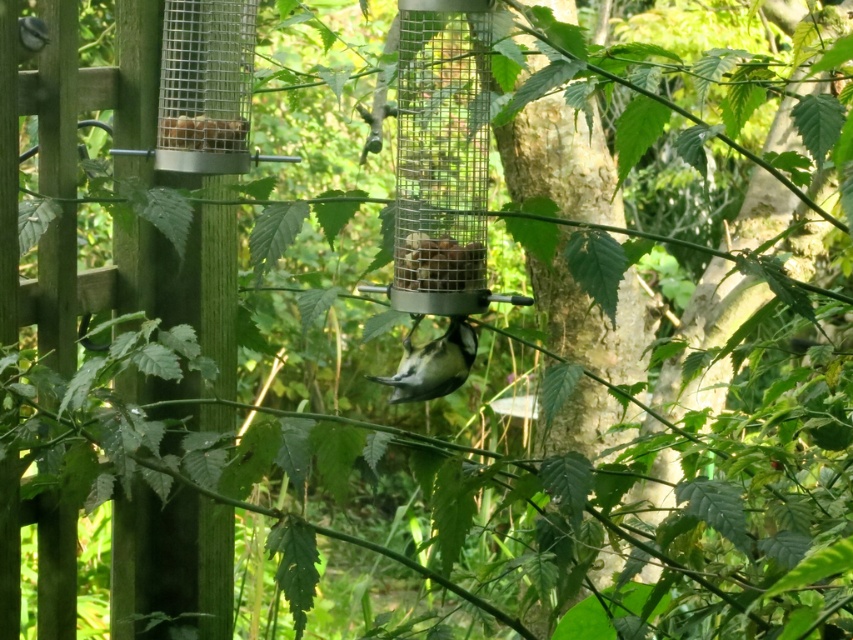
Question: Among these points, which one is nearest to the camera?

Choices:
 (A) (167, 124)
 (B) (409, 243)

Answer: (B)

Question: Which point is farther to the camera?

Choices:
 (A) (381, 378)
 (B) (236, 132)
 (C) (403, 252)

Answer: (B)

Question: Does metal mesh bird feeder at center have a larger size compared to white matte bird at center?

Choices:
 (A) no
 (B) yes

Answer: (B)

Question: Is white matte bird at center closer to camera compared to metal mesh container at upper left?

Choices:
 (A) no
 (B) yes

Answer: (B)

Question: Which object is closer to the camera taking this photo?

Choices:
 (A) metal mesh container at upper left
 (B) metal mesh bird feeder at center

Answer: (B)

Question: Does brown textured bird feeder at center come in front of metal mesh container at upper left?

Choices:
 (A) yes
 (B) no

Answer: (A)